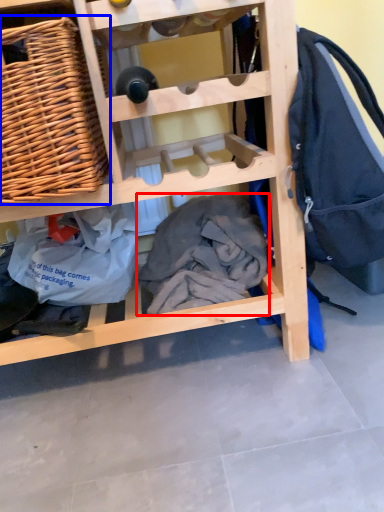
Question: Which object appears farthest to the camera in this image, clothing (highlighted by a red box) or picnic basket (highlighted by a blue box)?

Choices:
 (A) clothing
 (B) picnic basket

Answer: (A)